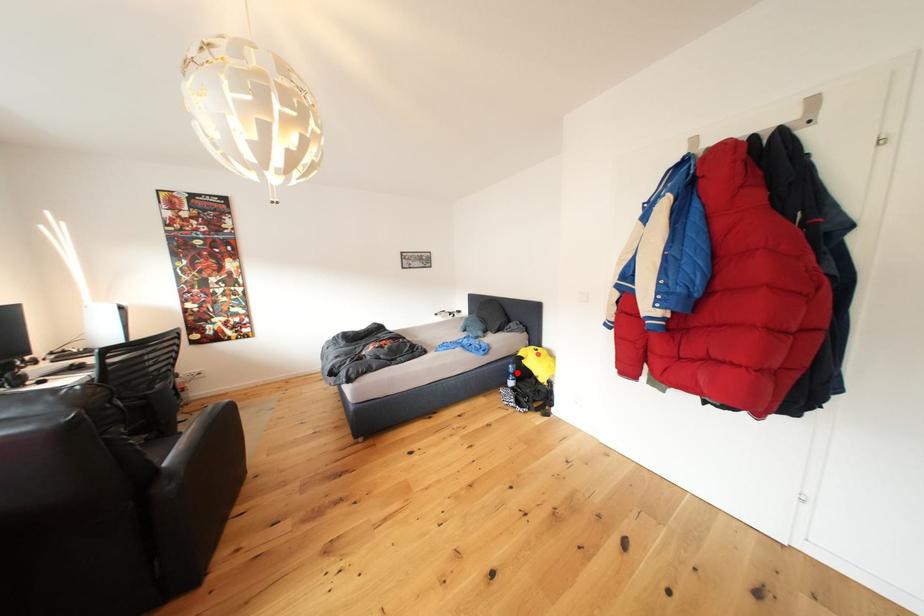
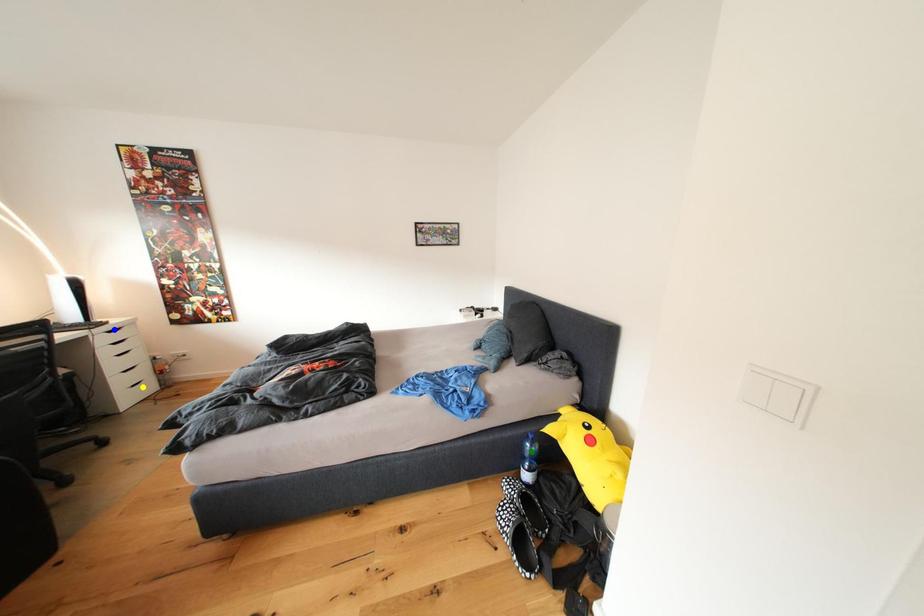
Question: I am providing you with two images of the same scene from different viewpoints. A red point is marked on the first image. You are given multiple points on the second image. Which mark in image 2 goes with the point in image 1?

Choices:
 (A) green point
 (B) yellow point
 (C) blue point

Answer: (A)